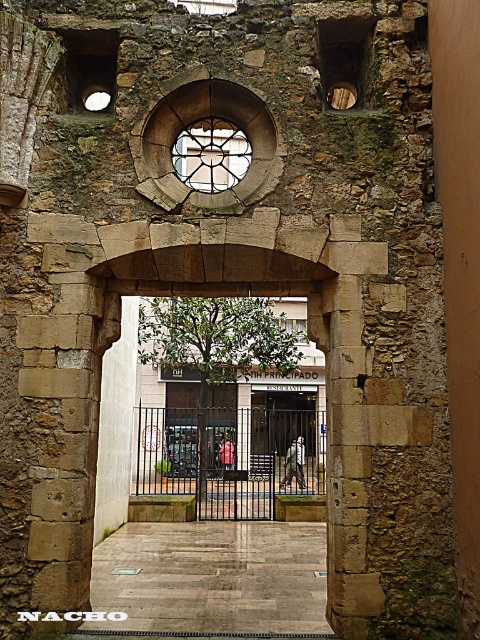
Who is higher up, stone archway at center or cracked stone archway at center?

cracked stone archway at center

Is point (96, 532) positioned after point (255, 176)?

Yes, it is.

Between point (327, 337) and point (153, 148), which one is positioned in front?

Point (327, 337) is more forward.

The width and height of the screenshot is (480, 640). In order to click on stone archway at center in this screenshot , I will do `click(326, 376)`.

Which is more to the left, brown rough stone pillar at right or stained glass window at center?

stained glass window at center

Who is more forward, (448, 26) or (204, 157)?

Point (448, 26)

Is point (462, 268) more distant than point (211, 152)?

No, (462, 268) is in front of (211, 152).

Find the location of a particular element. The height and width of the screenshot is (640, 480). brown rough stone pillar at right is located at coordinates (459, 269).

Can you confirm if cracked stone archway at center is thinner than stained glass window at center?

Incorrect, cracked stone archway at center's width is not less than stained glass window at center's.

The height and width of the screenshot is (640, 480). I want to click on cracked stone archway at center, so (x=204, y=131).